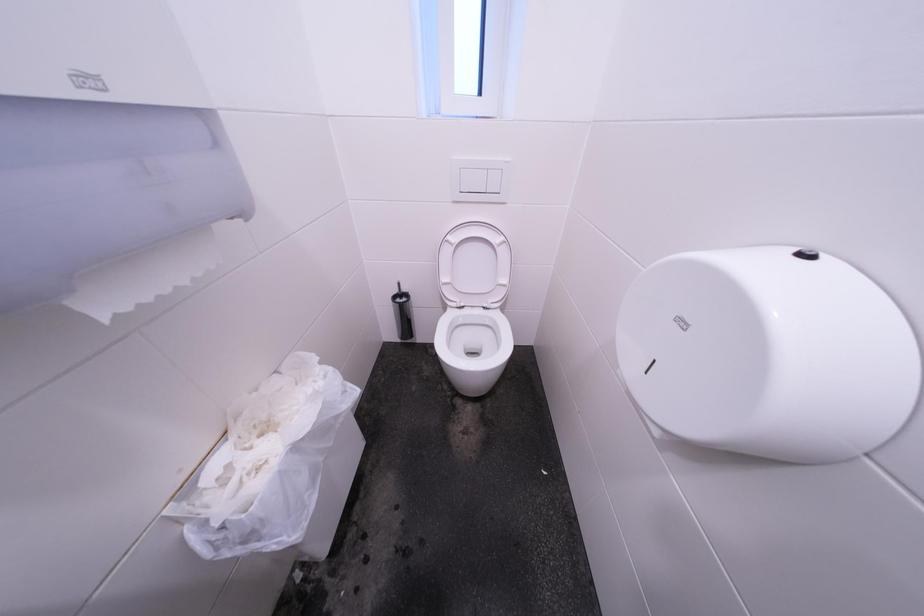
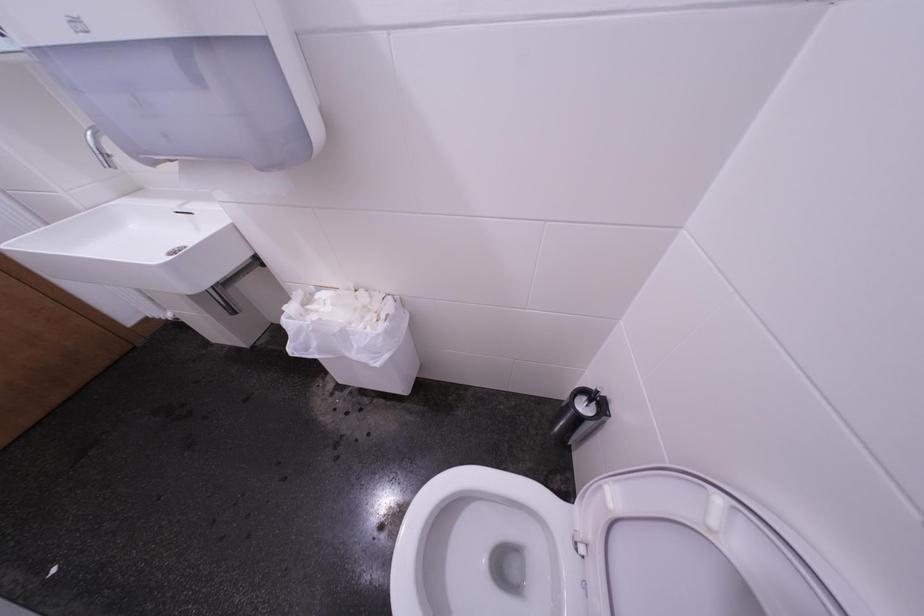
Based on the continuous images, in which direction is the camera rotating?

The camera rotated toward left-down.